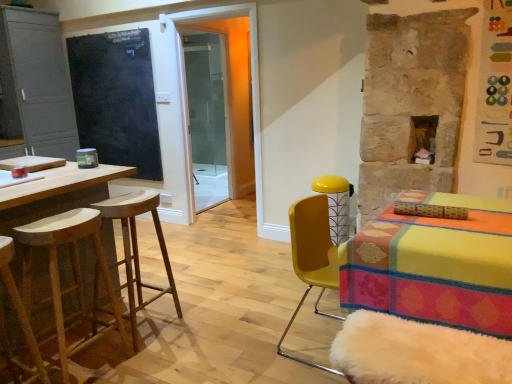
What are the coordinates of `vacant space to the right of natural wood stool at left, the second stool from the back` in the screenshot? It's located at (152, 360).